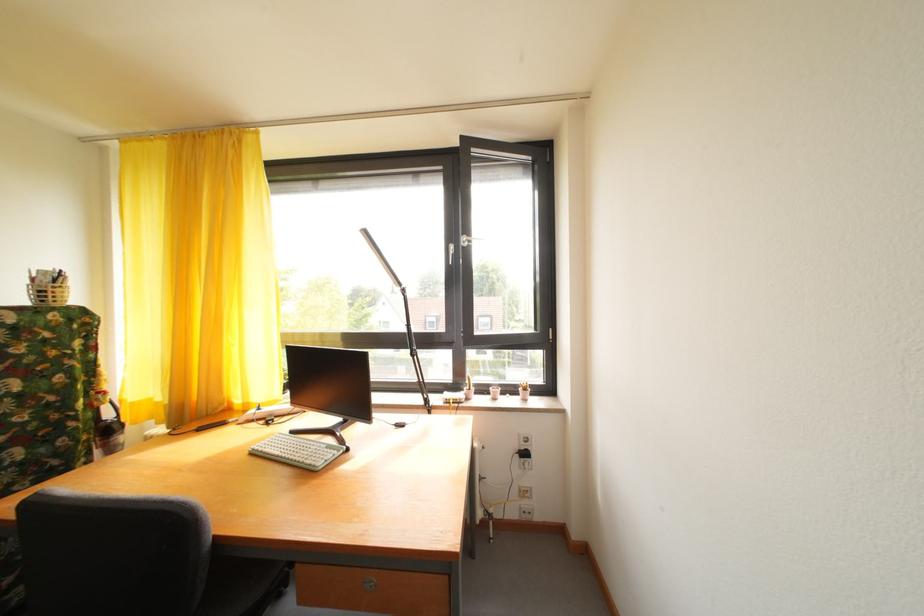
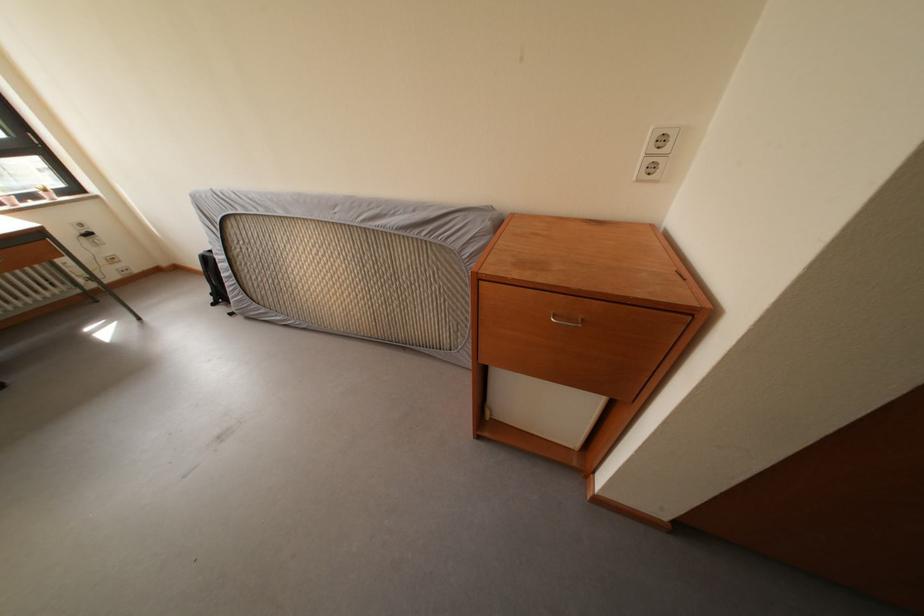
Where in the second image is the point corresponding to [533,509] from the first image?

(128, 273)